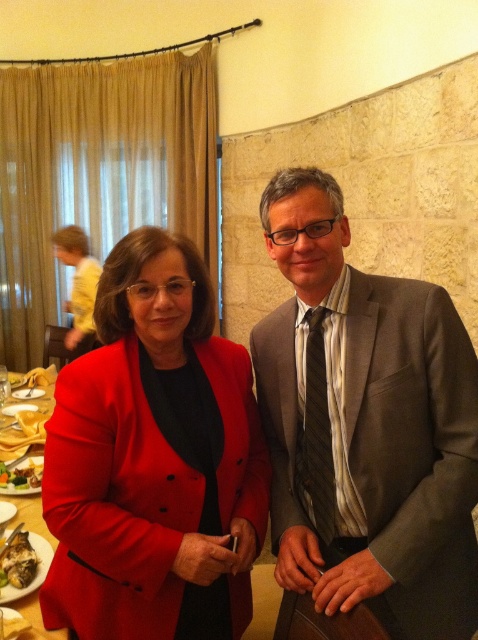
Question: Which of the following is the farthest from the observer?

Choices:
 (A) smooth yellow plate at lower left
 (B) yellow cotton shirt at left
 (C) matte red table at lower left

Answer: (B)

Question: Which of the following is the farthest from the observer?

Choices:
 (A) smooth yellow plate at lower left
 (B) yellow cotton shirt at left
 (C) matte gray suit at center

Answer: (B)

Question: Can you confirm if matte gray suit at center is positioned to the right of yellow cotton shirt at left?

Choices:
 (A) no
 (B) yes

Answer: (B)

Question: Can you confirm if matte red blazer at center is bigger than matte red table at lower left?

Choices:
 (A) yes
 (B) no

Answer: (A)

Question: Which point appears farthest from the camera in this image?

Choices:
 (A) (25, 582)
 (B) (101, 525)
 (C) (334, 588)

Answer: (A)

Question: In this image, where is matte red blazer at center located relative to matte red table at lower left?

Choices:
 (A) above
 (B) below

Answer: (A)